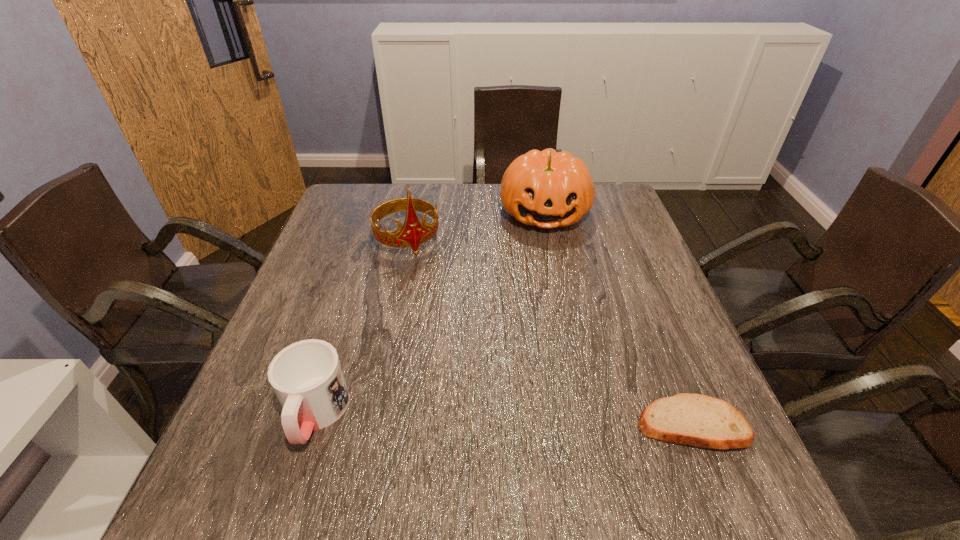
Image resolution: width=960 pixels, height=540 pixels. I want to click on object located in the near left corner section of the desktop, so click(307, 378).

Where is `object that is at the far right corner`? object that is at the far right corner is located at coordinates (549, 189).

You are a GUI agent. You are given a task and a screenshot of the screen. Output one action in this format:
    pyautogui.click(x=<x>, y=<y>)
    Task: Click on the object present at the near right corner
    The height and width of the screenshot is (540, 960).
    Given the screenshot: What is the action you would take?
    pyautogui.click(x=692, y=419)

Where is `blank area at the far edge`? This screenshot has height=540, width=960. blank area at the far edge is located at coordinates (488, 191).

This screenshot has height=540, width=960. What are the coordinates of `vacant space at the near edge` in the screenshot? It's located at (486, 445).

The width and height of the screenshot is (960, 540). In the image, there is a desktop. In order to click on free space at the left edge in this screenshot , I will do `click(263, 363)`.

Find the location of a particular element. vacant space at the right edge of the desktop is located at coordinates (617, 257).

The height and width of the screenshot is (540, 960). In the image, there is a desktop. In order to click on free region at the far left corner in this screenshot , I will do `click(343, 207)`.

In the image, there is a desktop. Where is `free space at the near left corner`? The width and height of the screenshot is (960, 540). free space at the near left corner is located at coordinates (276, 431).

At what (x,y) coordinates should I click in order to perform the action: click on unoccupied area between the pita bread and the third tallest object. Please return your answer as a coordinate pair (x, y). Image resolution: width=960 pixels, height=540 pixels. Looking at the image, I should click on (504, 419).